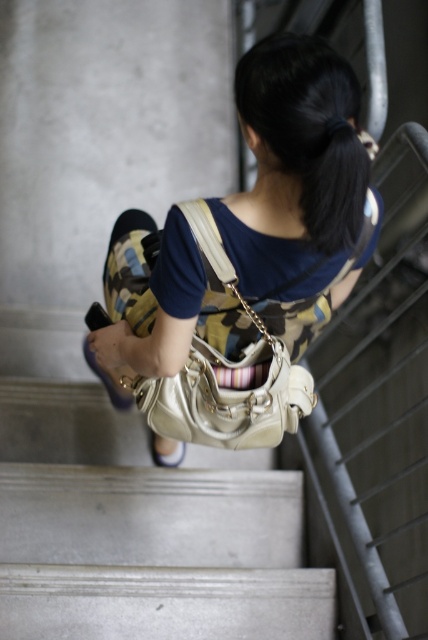
Does matte beige shoulder bag at center have a lesser height compared to white fabric sandal at lower center?

No, matte beige shoulder bag at center is not shorter than white fabric sandal at lower center.

Is point (303, 314) farther from viewer compared to point (171, 467)?

No, it is in front of (171, 467).

Is point (148, 404) behind point (157, 458)?

No, it is not.

You are a GUI agent. You are given a task and a screenshot of the screen. Output one action in this format:
    pyautogui.click(x=<x>, y=<y>)
    Task: Click on the matte beige shoulder bag at center
    The height and width of the screenshot is (640, 428).
    Given the screenshot: What is the action you would take?
    pyautogui.click(x=222, y=305)

Is point (323, 140) positioned behind point (222, 330)?

No, it is not.

Does matte beige purse at center lie behind matte beige shoulder bag at center?

No, it is not.

Between point (312, 129) and point (139, 260), which one is positioned in front?

Point (312, 129)

You are a GUI agent. You are given a task and a screenshot of the screen. Output one action in this format:
    pyautogui.click(x=<x>, y=<y>)
    Task: Click on the matte beige purse at center
    The height and width of the screenshot is (640, 428).
    Given the screenshot: What is the action you would take?
    pyautogui.click(x=299, y=188)

Does matte beige purse at center have a lesser width compared to white fabric sandal at lower center?

In fact, matte beige purse at center might be wider than white fabric sandal at lower center.

Who is positioned more to the right, matte beige purse at center or white fabric sandal at lower center?

From the viewer's perspective, matte beige purse at center appears more on the right side.

Is point (148, 243) farther from viewer compared to point (181, 452)?

No, (148, 243) is closer to viewer.

Where is `matte beige purse at center`? matte beige purse at center is located at coordinates (299, 188).